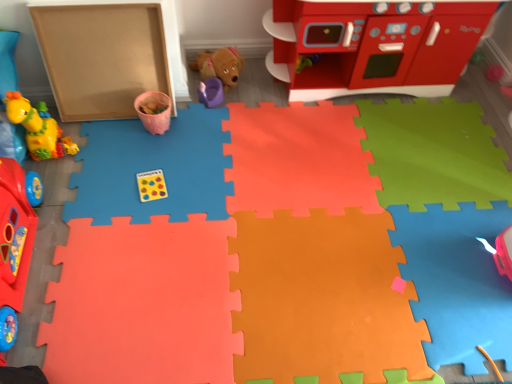
Question: Does pink matte cup at upper center, acting as the third toy starting from the left, come in front of rubber duck at left, which appears as the 2th toy when viewed from the right?

Choices:
 (A) no
 (B) yes

Answer: (A)

Question: Is pink matte cup at upper center, marked as the 5th toy in a right-to-left arrangement, located outside rubber duck at left, which appears as the 2th toy when viewed from the right?

Choices:
 (A) no
 (B) yes

Answer: (B)

Question: Does pink matte cup at upper center, marked as the 5th toy in a right-to-left arrangement, have a smaller size compared to rubber duck at left, which appears as the 2th toy when viewed from the right?

Choices:
 (A) no
 (B) yes

Answer: (B)

Question: From the image's perspective, would you say pink matte cup at upper center, acting as the third toy starting from the left, is shown under rubber duck at left, the 6th toy from the left?

Choices:
 (A) no
 (B) yes

Answer: (A)

Question: Is pink matte cup at upper center, acting as the third toy starting from the left, in contact with rubber duck at left, the 6th toy from the left?

Choices:
 (A) yes
 (B) no

Answer: (B)

Question: Is pink matte cup at upper center, marked as the 5th toy in a right-to-left arrangement, facing away from rubber duck at left, the 6th toy from the left?

Choices:
 (A) no
 (B) yes

Answer: (A)

Question: Is the position of matte yellow giraffe at left, which is the sixth toy in right-to-left order, more distant than that of pink matte cup at upper center, acting as the third toy starting from the left?

Choices:
 (A) yes
 (B) no

Answer: (B)

Question: Is matte yellow giraffe at left, the second toy viewed from the left, completely or partially outside of pink matte cup at upper center, marked as the 5th toy in a right-to-left arrangement?

Choices:
 (A) yes
 (B) no

Answer: (A)

Question: Is matte yellow giraffe at left, the second toy viewed from the left, smaller than pink matte cup at upper center, acting as the third toy starting from the left?

Choices:
 (A) yes
 (B) no

Answer: (B)

Question: Is matte yellow giraffe at left, the second toy viewed from the left, positioned with its back to pink matte cup at upper center, acting as the third toy starting from the left?

Choices:
 (A) yes
 (B) no

Answer: (B)

Question: Does matte yellow giraffe at left, the second toy viewed from the left, lie in front of pink matte cup at upper center, marked as the 5th toy in a right-to-left arrangement?

Choices:
 (A) no
 (B) yes

Answer: (B)

Question: Can you confirm if matte yellow giraffe at left, which is the sixth toy in right-to-left order, is taller than pink matte cup at upper center, acting as the third toy starting from the left?

Choices:
 (A) yes
 (B) no

Answer: (A)

Question: Is matte cardboard box at left at the left side of pink matte cup at upper center, acting as the third toy starting from the left?

Choices:
 (A) yes
 (B) no

Answer: (A)